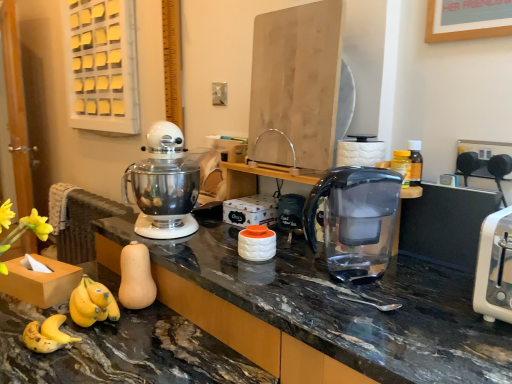
Where is `free space in front of matte black jar at center`? This screenshot has width=512, height=384. free space in front of matte black jar at center is located at coordinates (297, 245).